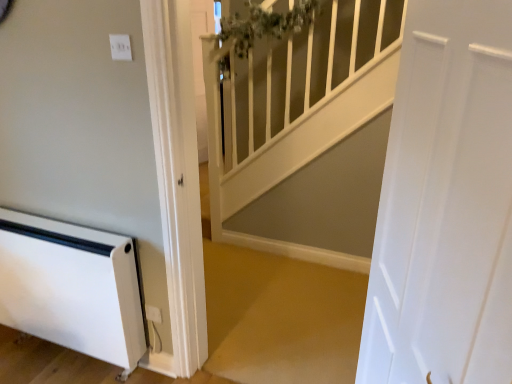
Question: Considering the relative sizes of white plastic electric outlet at lower center and white glossy banister at upper center in the image provided, is white plastic electric outlet at lower center bigger than white glossy banister at upper center?

Choices:
 (A) yes
 (B) no

Answer: (B)

Question: Is white plastic electric outlet at lower center not inside white glossy banister at upper center?

Choices:
 (A) no
 (B) yes

Answer: (B)

Question: From the image's perspective, is white plastic electric outlet at lower center under white glossy banister at upper center?

Choices:
 (A) yes
 (B) no

Answer: (A)

Question: Is white plastic electric outlet at lower center behind white glossy banister at upper center?

Choices:
 (A) yes
 (B) no

Answer: (A)

Question: Is white plastic electric outlet at lower center smaller than white glossy banister at upper center?

Choices:
 (A) no
 (B) yes

Answer: (B)

Question: Considering the positions of white glossy banister at upper center and white plastic heater at lower left in the image, is white glossy banister at upper center wider or thinner than white plastic heater at lower left?

Choices:
 (A) thin
 (B) wide

Answer: (A)

Question: Is white glossy banister at upper center inside or outside of white plastic heater at lower left?

Choices:
 (A) inside
 (B) outside

Answer: (B)

Question: In terms of height, does white glossy banister at upper center look taller or shorter compared to white plastic heater at lower left?

Choices:
 (A) short
 (B) tall

Answer: (B)

Question: In the image, is white glossy banister at upper center on the left side or the right side of white plastic heater at lower left?

Choices:
 (A) right
 (B) left

Answer: (A)

Question: Considering their positions, is white plastic heater at lower left located in front of or behind white glossy banister at upper center?

Choices:
 (A) behind
 (B) front

Answer: (A)

Question: Is white plastic heater at lower left inside the boundaries of white glossy banister at upper center, or outside?

Choices:
 (A) inside
 (B) outside

Answer: (B)

Question: Is white plastic heater at lower left wider or thinner than white glossy banister at upper center?

Choices:
 (A) thin
 (B) wide

Answer: (B)

Question: From the image's perspective, is white plastic heater at lower left above or below white glossy banister at upper center?

Choices:
 (A) below
 (B) above

Answer: (A)

Question: Is white glossy banister at upper center in front of or behind white smooth door at right in the image?

Choices:
 (A) behind
 (B) front

Answer: (A)

Question: Looking at their shapes, would you say white glossy banister at upper center is wider or thinner than white smooth door at right?

Choices:
 (A) wide
 (B) thin

Answer: (A)